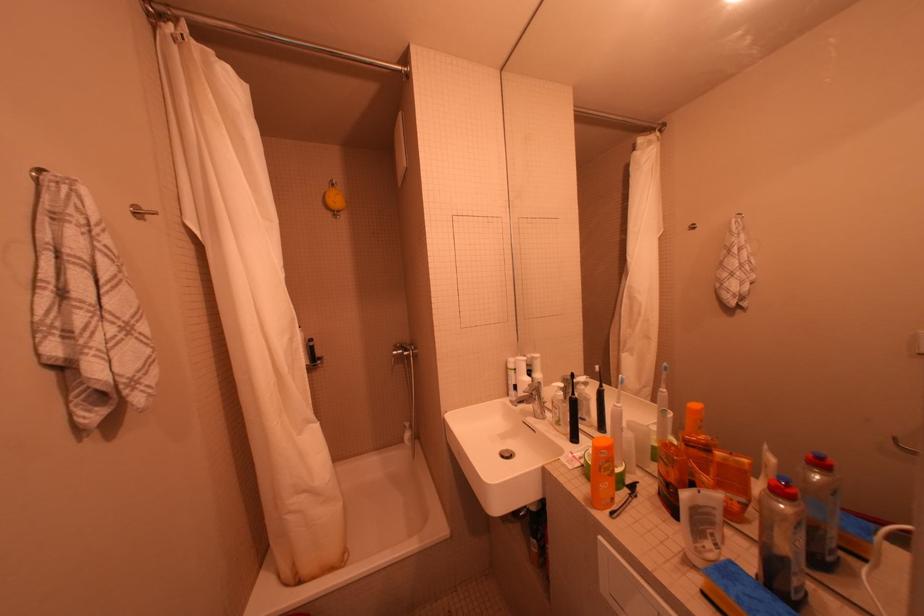
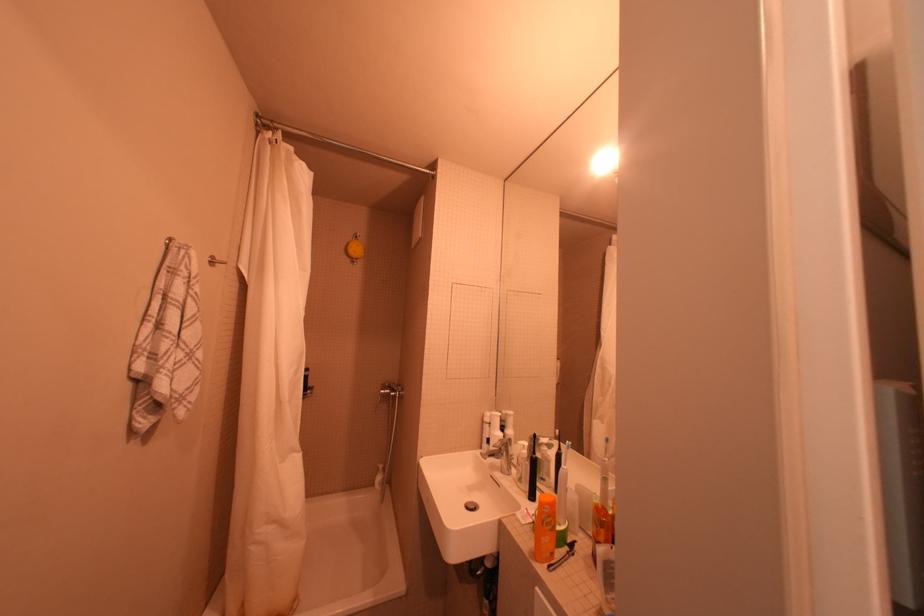
Find the pixel in the second image that matches [612,519] in the first image.

(551, 570)